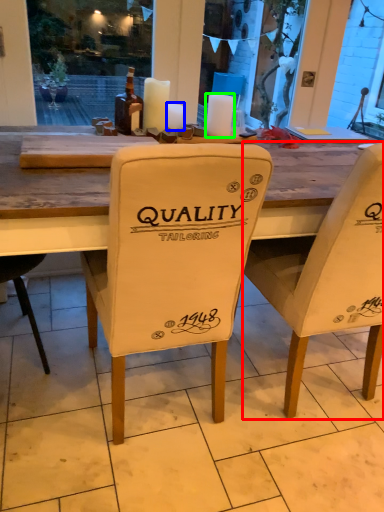
Question: Estimate the real-world distances between objects in this image. Which object is closer to chair (highlighted by a red box), candle (highlighted by a blue box) or candle (highlighted by a green box)?

Choices:
 (A) candle
 (B) candle

Answer: (B)